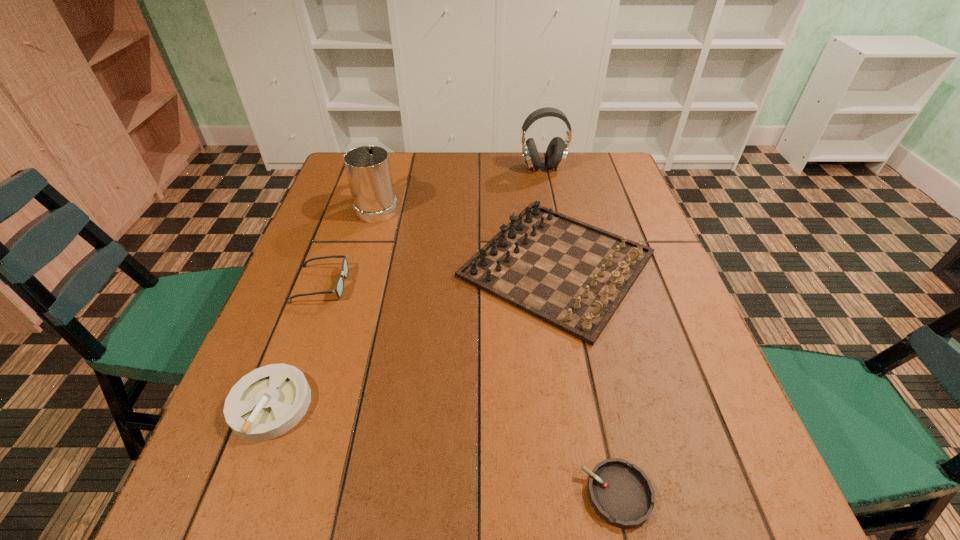
This screenshot has height=540, width=960. I want to click on object that is the third closest one to the taller ashtray, so [621, 494].

Locate an element on the screen. Image resolution: width=960 pixels, height=540 pixels. free space that satisfies the following two spatial constraints: 1. on the ear cups of the headset; 2. on the left side of the shortest object is located at coordinates (607, 494).

This screenshot has height=540, width=960. Find the location of `free space that satisfies the following two spatial constraints: 1. on the face of the nearest object; 2. on the left side of the spectacles`. free space that satisfies the following two spatial constraints: 1. on the face of the nearest object; 2. on the left side of the spectacles is located at coordinates (244, 494).

At what (x,y) coordinates should I click in order to perform the action: click on vacant space that satisfies the following two spatial constraints: 1. on the back side of the taller ashtray; 2. on the right side of the third tallest object. Please return your answer as a coordinate pair (x, y). The width and height of the screenshot is (960, 540). Looking at the image, I should click on pyautogui.click(x=324, y=265).